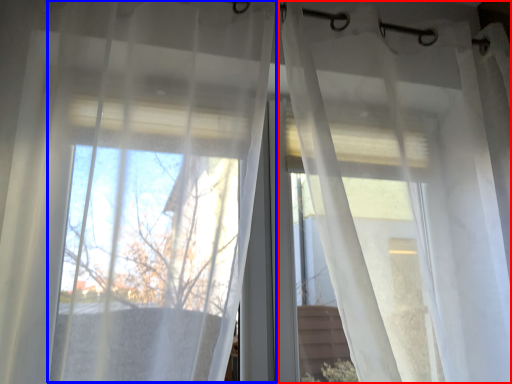
Question: Which object appears farthest to the camera in this image, curtain (highlighted by a red box) or curtain (highlighted by a blue box)?

Choices:
 (A) curtain
 (B) curtain

Answer: (A)